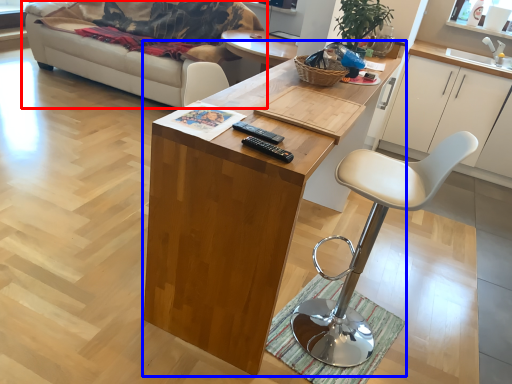
Question: Which object appears farthest to the camera in this image, studio couch (highlighted by a red box) or desk (highlighted by a blue box)?

Choices:
 (A) studio couch
 (B) desk

Answer: (A)